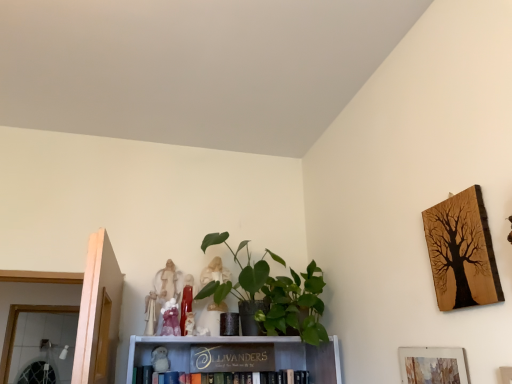
Question: Should I look upward or downward to see wooden sign at center, the first book positioned from the bottom?

Choices:
 (A) down
 (B) up

Answer: (A)

Question: Is wooden sign at center, the 2th book viewed from the top, positioned in front of green matte plant at center?

Choices:
 (A) no
 (B) yes

Answer: (A)

Question: From the image's perspective, is wooden sign at center, the 2th book viewed from the top, located beneath green matte plant at center?

Choices:
 (A) yes
 (B) no

Answer: (A)

Question: Is wooden sign at center, the 2th book viewed from the top, positioned behind green matte plant at center?

Choices:
 (A) no
 (B) yes

Answer: (B)

Question: Does wooden sign at center, the first book positioned from the bottom, appear on the right side of green matte plant at center?

Choices:
 (A) yes
 (B) no

Answer: (B)

Question: Is wooden sign at center, the 2th book viewed from the top, with green matte plant at center?

Choices:
 (A) yes
 (B) no

Answer: (B)

Question: Is wooden sign at center, the first book positioned from the bottom, facing towards green matte plant at center?

Choices:
 (A) yes
 (B) no

Answer: (B)

Question: Is wooden tree art at upper right, marked as the second picture frame in a bottom-to-top arrangement, oriented away from wooden sign at center, the 2th book viewed from the top?

Choices:
 (A) yes
 (B) no

Answer: (B)

Question: Is wooden tree art at upper right, arranged as the first picture frame when viewed from the top, further to camera compared to wooden sign at center, the first book positioned from the bottom?

Choices:
 (A) no
 (B) yes

Answer: (A)

Question: Could you tell me if wooden tree art at upper right, arranged as the first picture frame when viewed from the top, is facing wooden sign at center, the 2th book viewed from the top?

Choices:
 (A) yes
 (B) no

Answer: (B)

Question: Considering the relative sizes of wooden tree art at upper right, arranged as the first picture frame when viewed from the top, and wooden sign at center, the first book positioned from the bottom, in the image provided, is wooden tree art at upper right, arranged as the first picture frame when viewed from the top, smaller than wooden sign at center, the first book positioned from the bottom,?

Choices:
 (A) no
 (B) yes

Answer: (B)

Question: From a real-world perspective, is wooden tree art at upper right, marked as the second picture frame in a bottom-to-top arrangement, beneath wooden sign at center, the 2th book viewed from the top?

Choices:
 (A) yes
 (B) no

Answer: (B)

Question: From a real-world perspective, is wooden tree art at upper right, arranged as the first picture frame when viewed from the top, located higher than wooden sign at center, the 2th book viewed from the top?

Choices:
 (A) no
 (B) yes

Answer: (B)

Question: Is white plush toy at center, positioned as the second toy in left-to-right order, further to the viewer compared to white fabric angel at upper center, which is the sixth toy in right-to-left order?

Choices:
 (A) yes
 (B) no

Answer: (A)